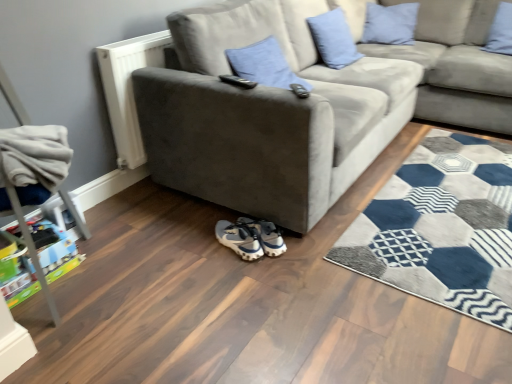
Question: Which direction should I rotate to face light blue fabric pillow at upper center, positioned as the 2th pillow in right-to-left order, — up or down?

Choices:
 (A) down
 (B) up

Answer: (B)

Question: Is light blue fabric pillow at upper center, arranged as the second pillow when viewed from the left, completely or partially inside blue fabric pillow at upper center, the fourth pillow viewed from the right?

Choices:
 (A) no
 (B) yes

Answer: (A)

Question: Is blue fabric pillow at upper center, the fourth pillow viewed from the right, taller than light blue fabric pillow at upper center, arranged as the second pillow when viewed from the left?

Choices:
 (A) no
 (B) yes

Answer: (A)

Question: From the image's perspective, is blue fabric pillow at upper center, the fourth pillow viewed from the right, over light blue fabric pillow at upper center, positioned as the third pillow in right-to-left order?

Choices:
 (A) yes
 (B) no

Answer: (B)

Question: Are blue fabric pillow at upper center, arranged as the first pillow when viewed from the left, and light blue fabric pillow at upper center, arranged as the second pillow when viewed from the left, beside each other?

Choices:
 (A) yes
 (B) no

Answer: (B)

Question: Is blue fabric pillow at upper center, arranged as the first pillow when viewed from the left, positioned behind light blue fabric pillow at upper center, arranged as the second pillow when viewed from the left?

Choices:
 (A) yes
 (B) no

Answer: (B)

Question: Is blue fabric pillow at upper center, arranged as the first pillow when viewed from the left, positioned far away from light blue fabric pillow at upper center, positioned as the third pillow in right-to-left order?

Choices:
 (A) no
 (B) yes

Answer: (A)

Question: From the image's perspective, is black plastic remote control at upper center, the 1th remote control from the right, under blue fabric pillow at upper center, arranged as the first pillow when viewed from the left?

Choices:
 (A) no
 (B) yes

Answer: (B)

Question: From a real-world perspective, is black plastic remote control at upper center, the 1th remote control from the right, physically below blue fabric pillow at upper center, the fourth pillow viewed from the right?

Choices:
 (A) yes
 (B) no

Answer: (B)

Question: Does black plastic remote control at upper center, the 1th remote control from the right, come in front of blue fabric pillow at upper center, the fourth pillow viewed from the right?

Choices:
 (A) no
 (B) yes

Answer: (B)

Question: Can you confirm if black plastic remote control at upper center, the second remote control viewed from the left, is positioned to the right of blue fabric pillow at upper center, arranged as the first pillow when viewed from the left?

Choices:
 (A) no
 (B) yes

Answer: (B)

Question: Is blue fabric pillow at upper center, arranged as the first pillow when viewed from the left, surrounded by black plastic remote control at upper center, the 1th remote control from the right?

Choices:
 (A) no
 (B) yes

Answer: (A)

Question: Does black plastic remote control at upper center, the 1th remote control from the right, have a lesser height compared to blue fabric pillow at upper center, the fourth pillow viewed from the right?

Choices:
 (A) yes
 (B) no

Answer: (A)

Question: Considering the relative sizes of black plastic remote control at upper center, acting as the 1th remote control starting from the left, and white fabric sneakers at lower center, the second footwear positioned from the left, in the image provided, is black plastic remote control at upper center, acting as the 1th remote control starting from the left, bigger than white fabric sneakers at lower center, the second footwear positioned from the left,?

Choices:
 (A) yes
 (B) no

Answer: (B)